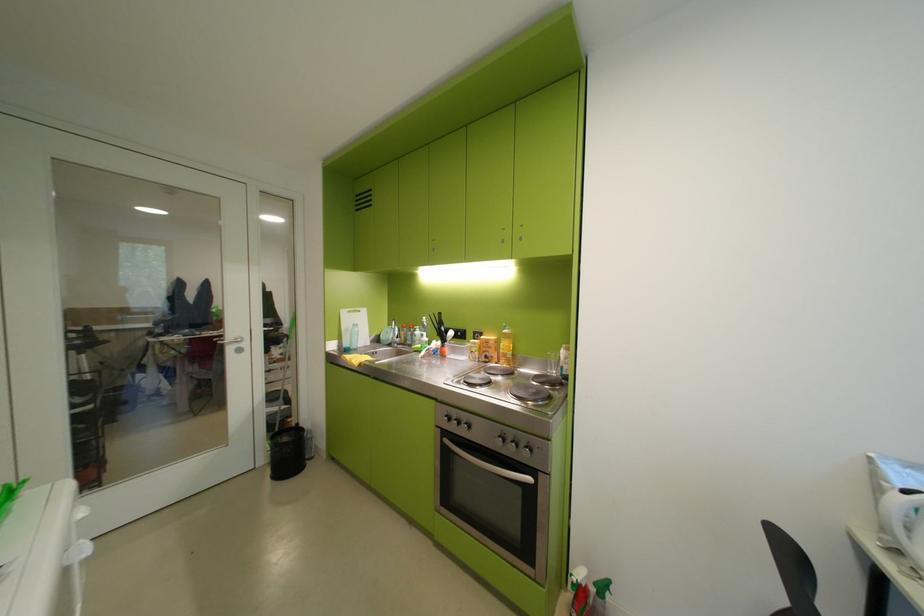
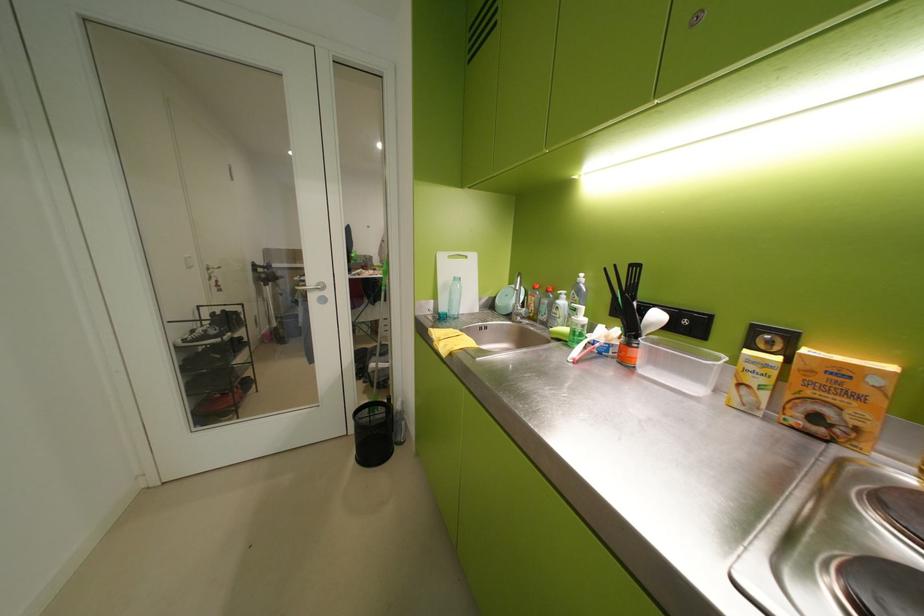
Where in the second image is the point corresponding to (x=357, y=345) from the first image?

(453, 310)